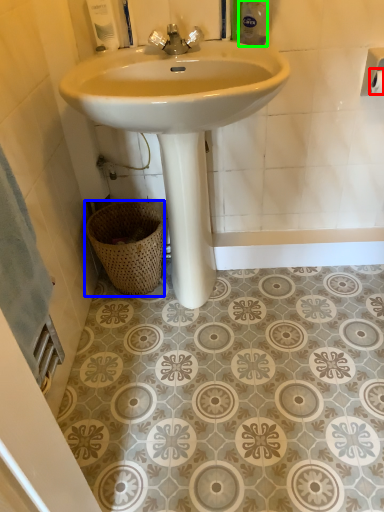
Question: Considering the real-world distances, which object is farthest from toilet paper (highlighted by a red box)? basket (highlighted by a blue box) or toiletry (highlighted by a green box)?

Choices:
 (A) basket
 (B) toiletry

Answer: (A)